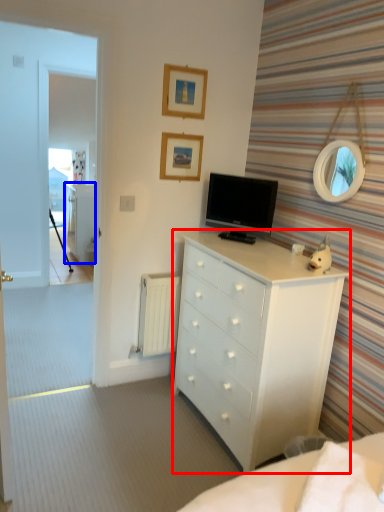
Question: Which object appears closest to the camera in this image, chest of drawers (highlighted by a red box) or file cabinet (highlighted by a blue box)?

Choices:
 (A) chest of drawers
 (B) file cabinet

Answer: (A)